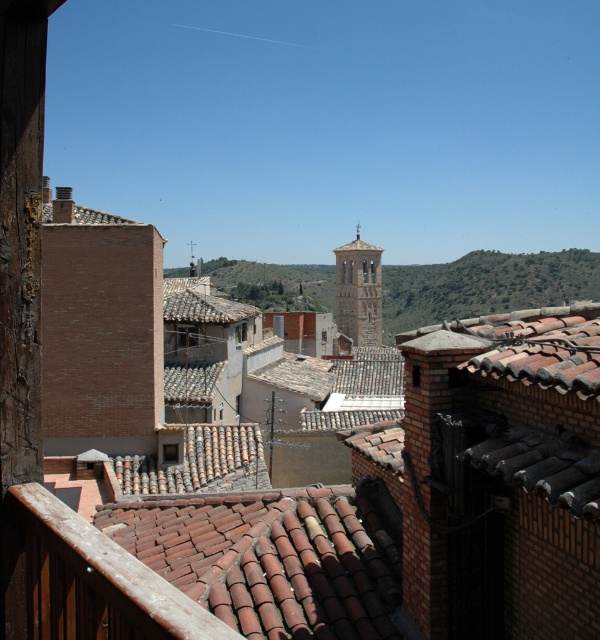
You are standing on a balcony overlooking the historic town. You want to estimate how far the green grassy hillside at center is from your current position. What is the approximate distance?

The green grassy hillside at center is approximately 152.19 meters away from the camera, so the distance is about 152.19 meters.

You are standing on a balcony overlooking a historic town. You see a green grassy hillside at center and a light brown stone bell tower at center. Which of these two objects is located to the right of the other?

The green grassy hillside at center is positioned on the right side of light brown stone bell tower at center.

You are an architect analyzing the rooftop layout of the historic town. You notice the terracotta clay tiles at center and the light brown stone bell tower at center. Which of these two objects takes up more area in the scene?

The light brown stone bell tower at center takes up more area than the terracotta clay tiles at center because the terracotta clay tiles at center occupies less space than light brown stone bell tower at center.